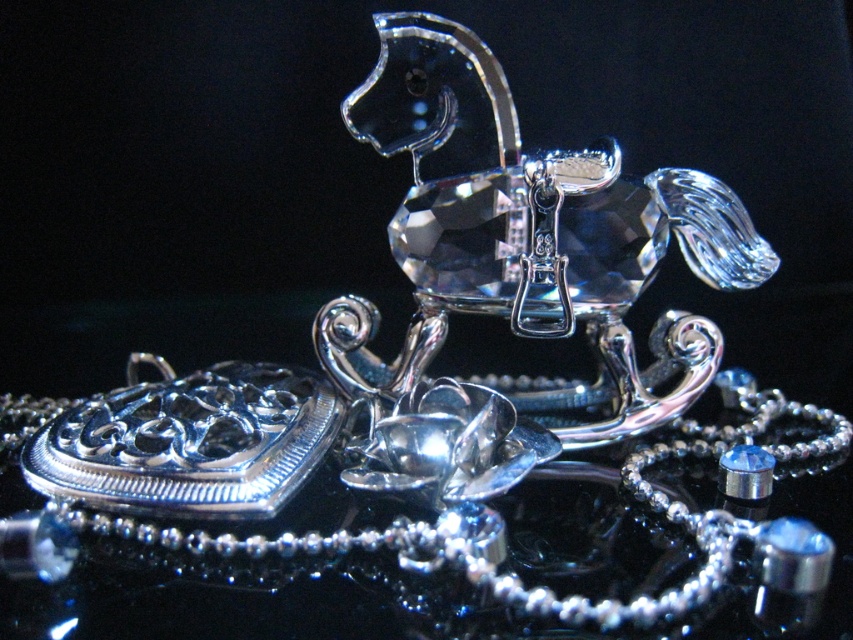
Can you confirm if silver metallic necklace at center is thinner than clear crystal horse at center?

No, silver metallic necklace at center is not thinner than clear crystal horse at center.

The image size is (853, 640). Identify the location of silver metallic necklace at center. (462, 516).

Does point (674, 612) lie behind point (718, 182)?

No, (674, 612) is in front of (718, 182).

This screenshot has width=853, height=640. Find the location of `silver metallic necklace at center`. silver metallic necklace at center is located at coordinates (462, 516).